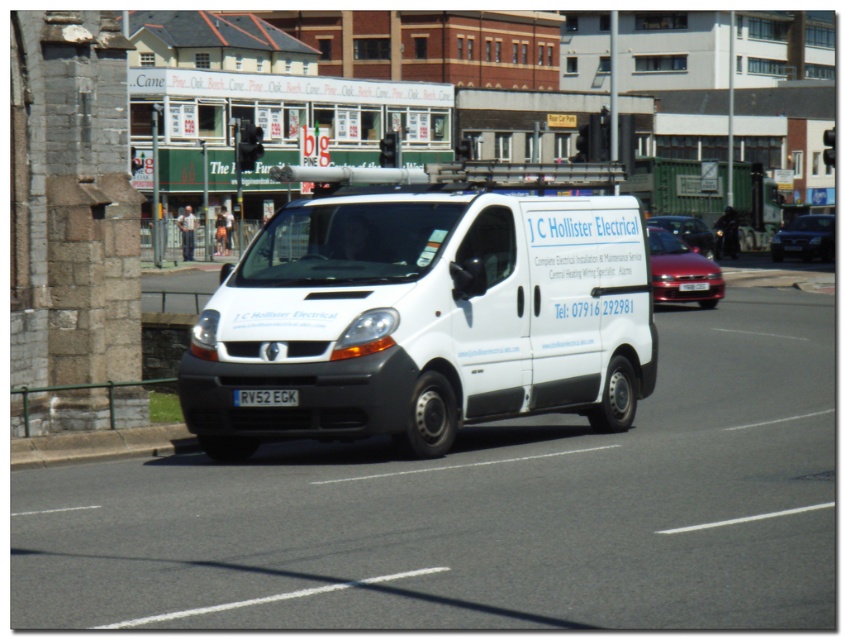
Is point (625, 276) less distant than point (290, 390)?

No.

Does white matte van at center have a smaller size compared to white rectangular at center?

No, white matte van at center is not smaller than white rectangular at center.

Identify the location of white matte van at center. (423, 314).

Which is below, shiny red sedan at center or white plastic license plate at center?

white plastic license plate at center

Does shiny red sedan at center come behind white plastic license plate at center?

No, shiny red sedan at center is closer to the viewer.

Which is behind, point (654, 262) or point (707, 288)?

The point (707, 288) is behind.

Locate an element on the screen. shiny red sedan at center is located at coordinates (680, 269).

Is point (812, 237) farther from viewer compared to point (691, 241)?

Yes, it is.

Which of these two, metallic silver sedan at right or shiny red car at center, stands shorter?

Standing shorter between the two is shiny red car at center.

Where is `metallic silver sedan at right`? metallic silver sedan at right is located at coordinates (805, 237).